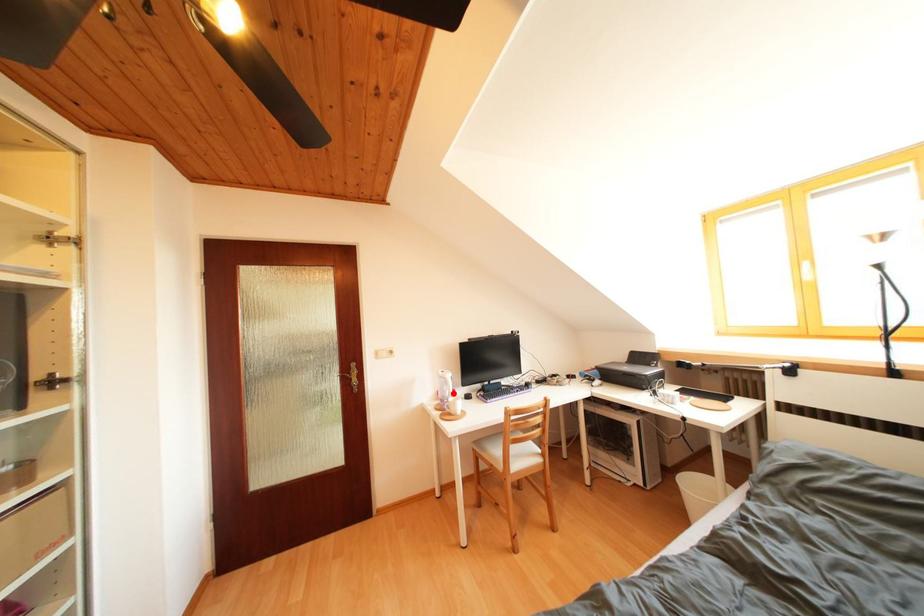
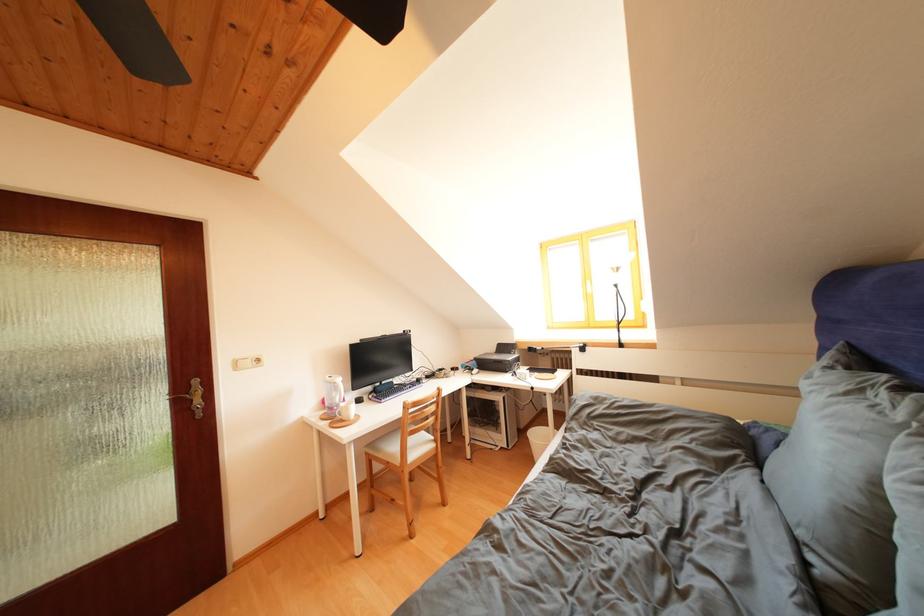
Find the pixel in the second image that matches the highlighted location in the first image.

(342, 399)